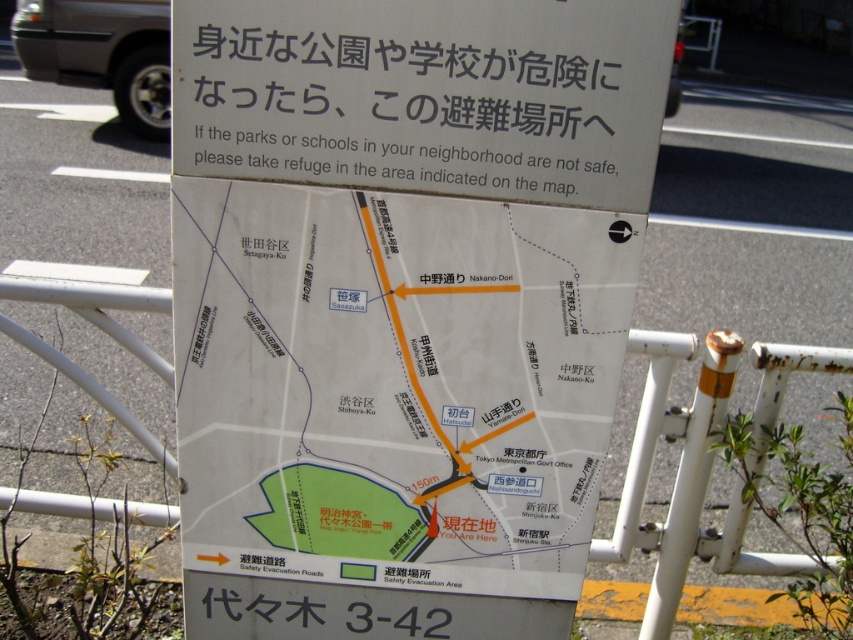
Based on the photo, between white paper sign at upper center and rusty metal pole at right, which one is positioned lower?

rusty metal pole at right is lower down.

Which of these two, white paper sign at upper center or rusty metal pole at right, stands shorter?

white paper sign at upper center

The height and width of the screenshot is (640, 853). I want to click on white paper sign at upper center, so click(426, 93).

Who is higher up, white paper map at center or rusty metal pole at right?

white paper map at center is above.

Can you confirm if white paper map at center is thinner than rusty metal pole at right?

In fact, white paper map at center might be wider than rusty metal pole at right.

Find the location of a particular element. The height and width of the screenshot is (640, 853). white paper map at center is located at coordinates (393, 384).

Identify the location of white paper map at center. (393, 384).

The image size is (853, 640). Find the location of `white paper map at center`. white paper map at center is located at coordinates (393, 384).

Is white paper map at center further to the viewer compared to white paper sign at upper center?

Yes, white paper map at center is further from the viewer.

Where is `white paper map at center`? This screenshot has width=853, height=640. white paper map at center is located at coordinates (393, 384).